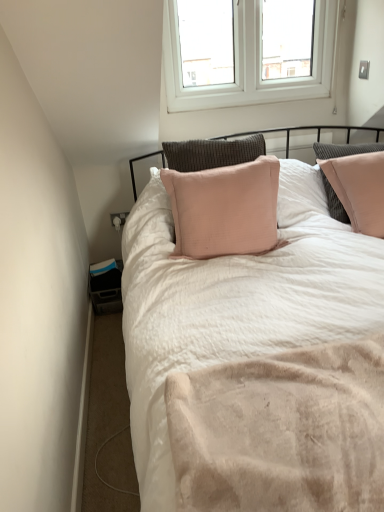
At what (x,y) coordinates should I click in order to perform the action: click on white plastic window at upper center. Please return your answer as a coordinate pair (x, y). Looking at the image, I should click on (248, 62).

What is the approximate width of white plastic window at upper center?

white plastic window at upper center is 4.08 inches in width.

What do you see at coordinates (248, 62) in the screenshot?
I see `white plastic window at upper center` at bounding box center [248, 62].

This screenshot has width=384, height=512. What are the coordinates of `white plastic window at upper center` in the screenshot? It's located at (248, 62).